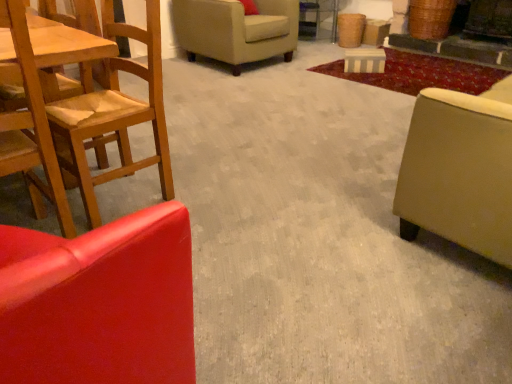
Question: From the image's perspective, is beige fabric studio couch at right on beige fabric armchair at upper center, which appears as the 1th chair when viewed from the back?

Choices:
 (A) yes
 (B) no

Answer: (B)

Question: Can beige fabric armchair at upper center, which appears as the 1th chair when viewed from the back, be found inside beige fabric studio couch at right?

Choices:
 (A) yes
 (B) no

Answer: (B)

Question: Is the depth of beige fabric studio couch at right less than that of beige fabric armchair at upper center, the third chair viewed from the front?

Choices:
 (A) no
 (B) yes

Answer: (B)

Question: Is beige fabric studio couch at right at the left side of beige fabric armchair at upper center, which appears as the 1th chair when viewed from the back?

Choices:
 (A) yes
 (B) no

Answer: (B)

Question: Is beige fabric studio couch at right smaller than beige fabric armchair at upper center, the third chair viewed from the front?

Choices:
 (A) no
 (B) yes

Answer: (A)

Question: Is beige fabric studio couch at right bigger than beige fabric armchair at upper center, which appears as the 1th chair when viewed from the back?

Choices:
 (A) no
 (B) yes

Answer: (B)

Question: Can you confirm if beige fabric studio couch at right is taller than wooden chair at left, marked as the 1th chair in a front-to-back arrangement?

Choices:
 (A) no
 (B) yes

Answer: (A)

Question: From a real-world perspective, is beige fabric studio couch at right positioned over wooden chair at left, marked as the 1th chair in a front-to-back arrangement, based on gravity?

Choices:
 (A) no
 (B) yes

Answer: (A)

Question: From a real-world perspective, does beige fabric studio couch at right sit lower than wooden chair at left, marked as the 1th chair in a front-to-back arrangement?

Choices:
 (A) yes
 (B) no

Answer: (A)

Question: From the image's perspective, does beige fabric studio couch at right appear lower than wooden chair at left, marked as the 1th chair in a front-to-back arrangement?

Choices:
 (A) no
 (B) yes

Answer: (A)

Question: Is beige fabric studio couch at right positioned far away from wooden chair at left, the third chair positioned from the back?

Choices:
 (A) no
 (B) yes

Answer: (B)

Question: Is beige fabric studio couch at right oriented away from wooden chair at left, the third chair positioned from the back?

Choices:
 (A) yes
 (B) no

Answer: (B)

Question: Is wooden chair at left, the third chair positioned from the back, wider than beige fabric armchair at upper center, the third chair viewed from the front?

Choices:
 (A) no
 (B) yes

Answer: (A)